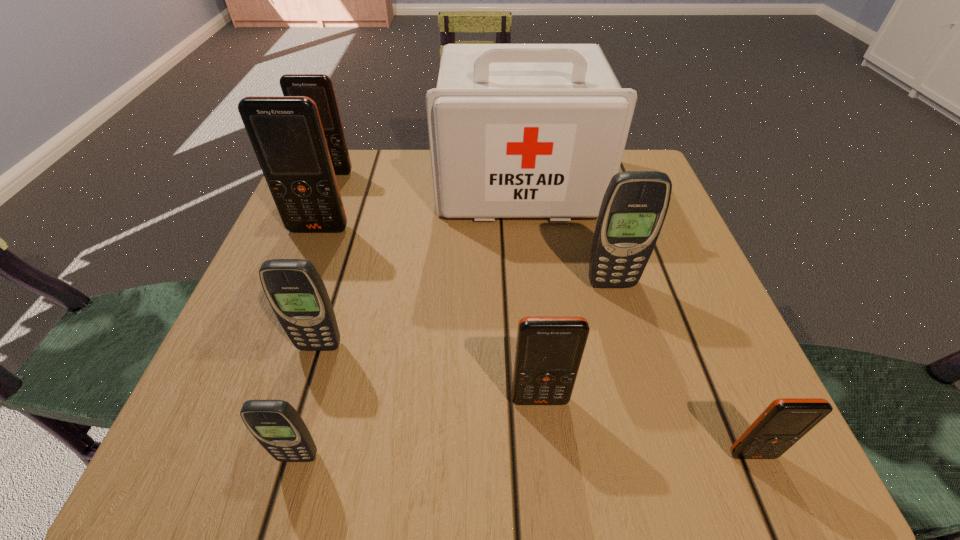
Find the location of a particular element. The width and height of the screenshot is (960, 540). cellular telephone that is at the far edge is located at coordinates tap(319, 87).

Locate an element on the screen. the first-aid kit that is at the right edge is located at coordinates (515, 130).

The image size is (960, 540). I want to click on object that is at the far left corner, so click(x=319, y=87).

I want to click on object that is at the near left corner, so click(x=277, y=426).

This screenshot has height=540, width=960. I want to click on object positioned at the far right corner, so click(515, 130).

Identify the location of object at the near right corner. This screenshot has height=540, width=960. (785, 421).

The width and height of the screenshot is (960, 540). In the image, there is a desktop. Find the location of `vacant space at the far edge`. vacant space at the far edge is located at coordinates (417, 180).

In the image, there is a desktop. At what (x,y) coordinates should I click in order to perform the action: click on vacant space at the near edge. Please return your answer as a coordinate pair (x, y). Looking at the image, I should click on (530, 437).

Identify the location of vacant region at the left edge of the desktop. The height and width of the screenshot is (540, 960). (253, 345).

This screenshot has width=960, height=540. In order to click on blank space at the right edge of the desktop in this screenshot , I will do `click(683, 242)`.